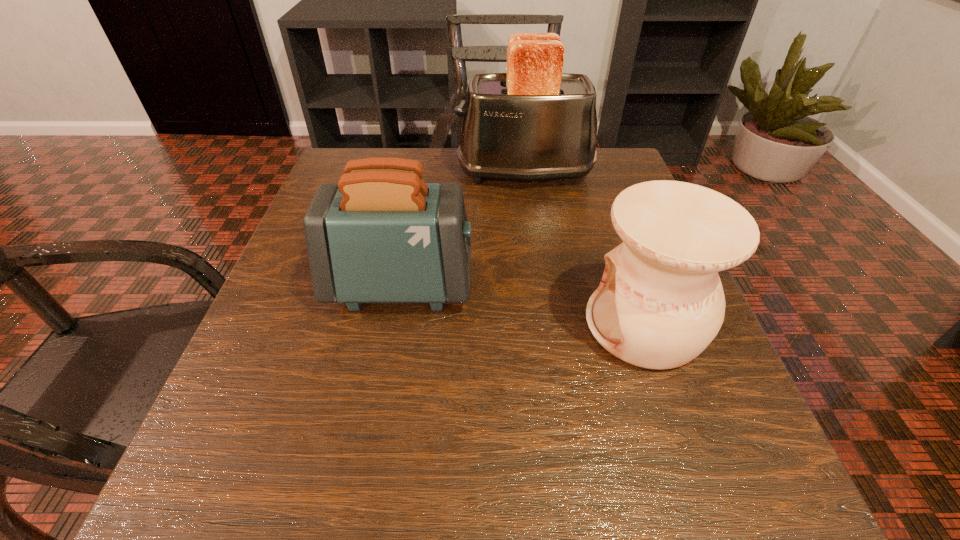
At what (x,y) coordinates should I click in order to perform the action: click on blank space at the far left corner of the desktop. Please return your answer as a coordinate pair (x, y). Image resolution: width=960 pixels, height=540 pixels. Looking at the image, I should click on (381, 151).

This screenshot has height=540, width=960. I want to click on free point at the far right corner, so click(590, 198).

Locate an element on the screen. The width and height of the screenshot is (960, 540). free space between the shorter toaster and the pottery is located at coordinates coord(523,305).

Locate an element on the screen. The width and height of the screenshot is (960, 540). vacant area between the pottery and the taller toaster is located at coordinates (585, 248).

Locate an element on the screen. Image resolution: width=960 pixels, height=540 pixels. empty space between the taller toaster and the pottery is located at coordinates tap(585, 248).

Where is `free space between the taller toaster and the pottery`? free space between the taller toaster and the pottery is located at coordinates (585, 248).

What are the coordinates of `free space between the pottery and the farthest object` in the screenshot? It's located at (585, 248).

Locate an element on the screen. The width and height of the screenshot is (960, 540). object that is the second nearest to the nearer toaster is located at coordinates (534, 122).

Point out which object is positioned as the second nearest to the farthest object. Please provide its 2D coordinates. Your answer should be formatted as a tuple, i.e. [(x, y)], where the tuple contains the x and y coordinates of a point satisfying the conditions above.

[(660, 303)]